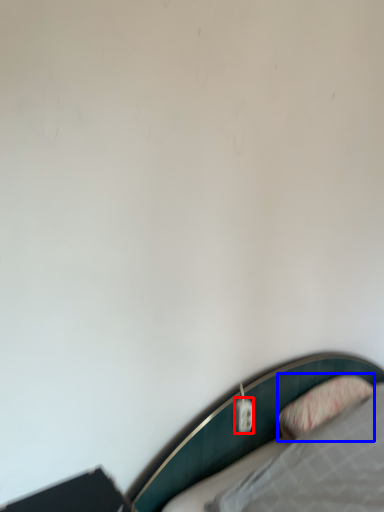
Question: Which object appears closest to the camera in this image, electric outlet (highlighted by a red box) or pillow (highlighted by a blue box)?

Choices:
 (A) electric outlet
 (B) pillow

Answer: (B)